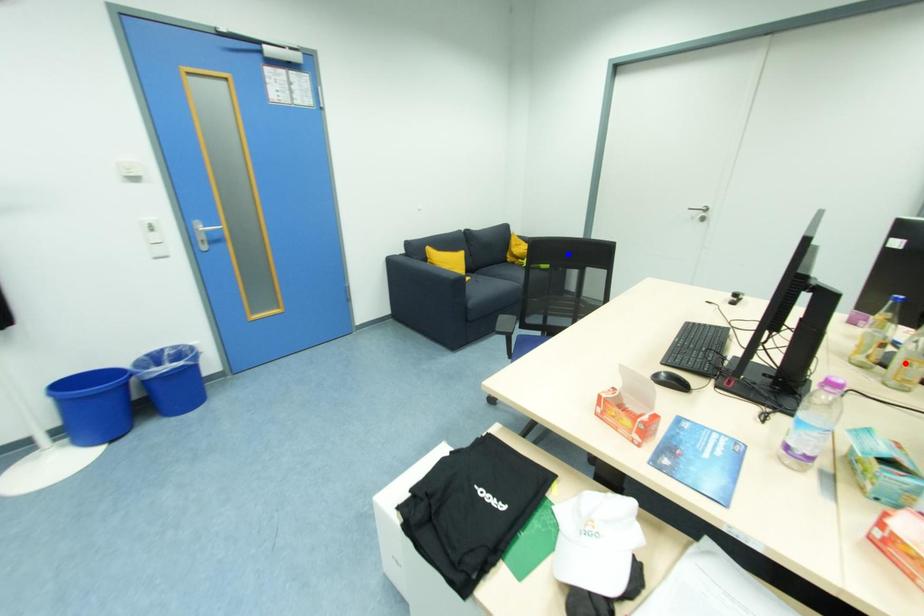
Question: In the image, two points are highlighted. Which point is nearer to the camera? Reply with the corresponding letter.

Choices:
 (A) blue point
 (B) red point

Answer: (B)